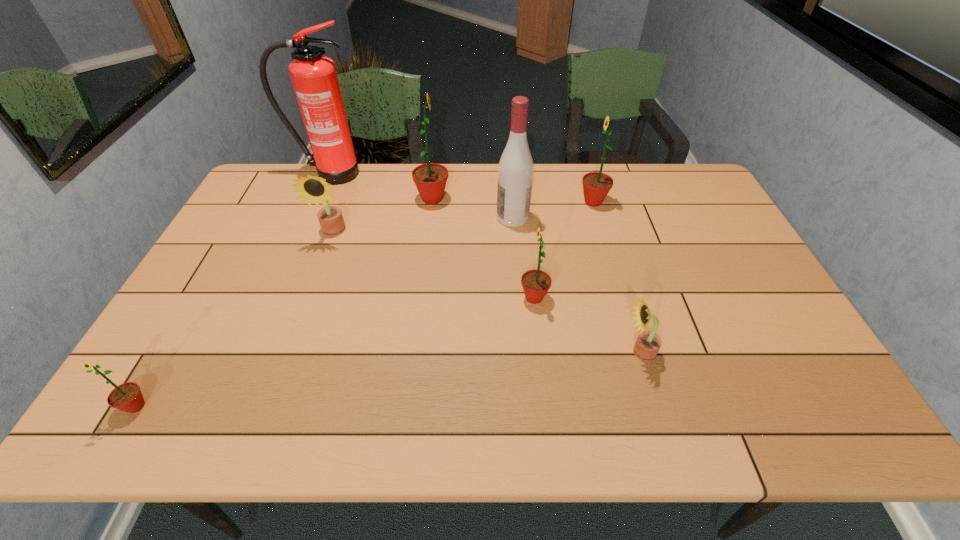
What are the coordinates of `the farther yellow sunflower` in the screenshot? It's located at (312, 188).

Find the location of a particular element. the right yellow sunflower is located at coordinates (648, 343).

Identify the location of the fifth farthest sunflower. The image size is (960, 540). (648, 343).

You are a GUI agent. You are given a task and a screenshot of the screen. Output one action in this format:
    pyautogui.click(x=<x>, y=<y>)
    Task: Click on the nearest green sunflower
    Image resolution: width=960 pixels, height=540 pixels.
    Given the screenshot: What is the action you would take?
    pyautogui.click(x=127, y=397)

Locate an element on the screen. the leftmost green sunflower is located at coordinates (127, 397).

Image resolution: width=960 pixels, height=540 pixels. Find the location of `vacant point located at the nozzle of the fire extinguisher`. vacant point located at the nozzle of the fire extinguisher is located at coordinates (305, 232).

Image resolution: width=960 pixels, height=540 pixels. I want to click on vacant region located on the label of the alcohol, so click(x=474, y=218).

This screenshot has width=960, height=540. What are the coordinates of `vacant space situated on the label of the alcohol` in the screenshot? It's located at (449, 218).

Identify the location of free region located on the label of the alcohol. Image resolution: width=960 pixels, height=540 pixels. (468, 218).

Find the location of `vacant space situated 0.340m on the face of the biggest green sunflower`. vacant space situated 0.340m on the face of the biggest green sunflower is located at coordinates (552, 199).